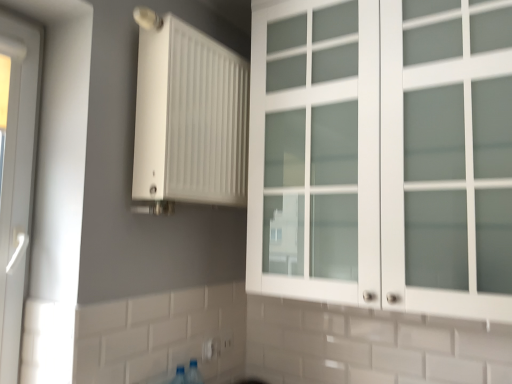
Question: Does white matte radiator at upper center have a larger size compared to white plastic door at left?

Choices:
 (A) no
 (B) yes

Answer: (B)

Question: Does white matte radiator at upper center have a lesser height compared to white plastic door at left?

Choices:
 (A) yes
 (B) no

Answer: (A)

Question: Can you confirm if white matte radiator at upper center is smaller than white plastic door at left?

Choices:
 (A) yes
 (B) no

Answer: (B)

Question: From a real-world perspective, is white matte radiator at upper center over white plastic door at left?

Choices:
 (A) no
 (B) yes

Answer: (B)

Question: Considering the relative sizes of white matte radiator at upper center and white plastic door at left in the image provided, is white matte radiator at upper center thinner than white plastic door at left?

Choices:
 (A) no
 (B) yes

Answer: (A)

Question: From a real-world perspective, does white matte radiator at upper center sit lower than white plastic door at left?

Choices:
 (A) no
 (B) yes

Answer: (A)

Question: Can you confirm if white plastic electric outlet at lower center, the first electric outlet in the front-to-back sequence, is positioned to the right of white plastic electric outlet at lower center, marked as the 1th electric outlet in a right-to-left arrangement?

Choices:
 (A) no
 (B) yes

Answer: (A)

Question: Could you tell me if white plastic electric outlet at lower center, arranged as the 1th electric outlet when viewed from the left, is turned towards white plastic electric outlet at lower center, which is the 2th electric outlet in front-to-back order?

Choices:
 (A) no
 (B) yes

Answer: (A)

Question: Considering the relative sizes of white plastic electric outlet at lower center, the first electric outlet in the front-to-back sequence, and white plastic electric outlet at lower center, marked as the 1th electric outlet in a back-to-front arrangement, in the image provided, is white plastic electric outlet at lower center, the first electric outlet in the front-to-back sequence, shorter than white plastic electric outlet at lower center, marked as the 1th electric outlet in a back-to-front arrangement,?

Choices:
 (A) yes
 (B) no

Answer: (B)

Question: Is white plastic electric outlet at lower center, which appears as the 2th electric outlet when viewed from the back, behind white plastic electric outlet at lower center, the 2th electric outlet from the left?

Choices:
 (A) yes
 (B) no

Answer: (B)

Question: Considering the relative sizes of white plastic electric outlet at lower center, the first electric outlet in the front-to-back sequence, and white plastic electric outlet at lower center, the 2th electric outlet from the left, in the image provided, is white plastic electric outlet at lower center, the first electric outlet in the front-to-back sequence, smaller than white plastic electric outlet at lower center, the 2th electric outlet from the left,?

Choices:
 (A) yes
 (B) no

Answer: (A)

Question: Is white plastic electric outlet at lower center, the first electric outlet in the front-to-back sequence, taller than white plastic electric outlet at lower center, which is the 2th electric outlet in front-to-back order?

Choices:
 (A) no
 (B) yes

Answer: (B)

Question: From a real-world perspective, is white plastic door at left located beneath white plastic electric outlet at lower center, acting as the 2th electric outlet starting from the right?

Choices:
 (A) no
 (B) yes

Answer: (A)